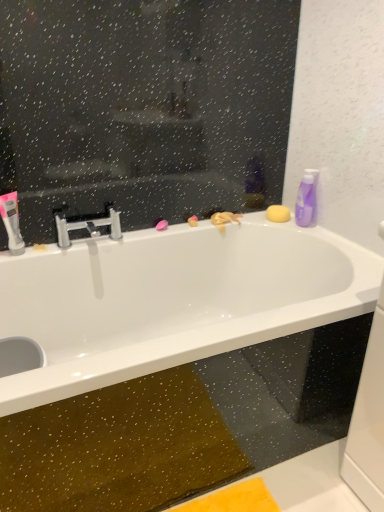
Locate an element on the screen. This screenshot has width=384, height=512. vacant region to the left of purple glossy bottle at upper right is located at coordinates (278, 221).